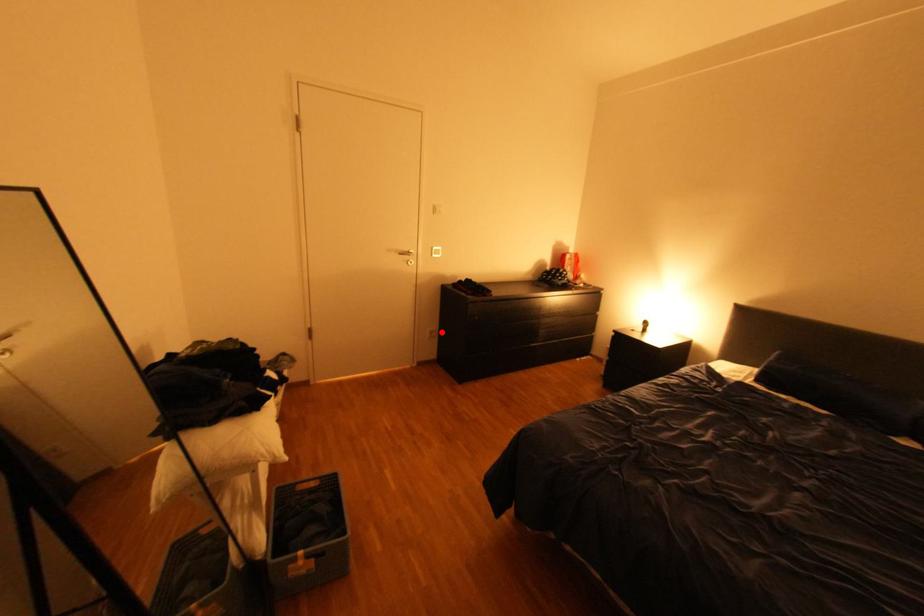
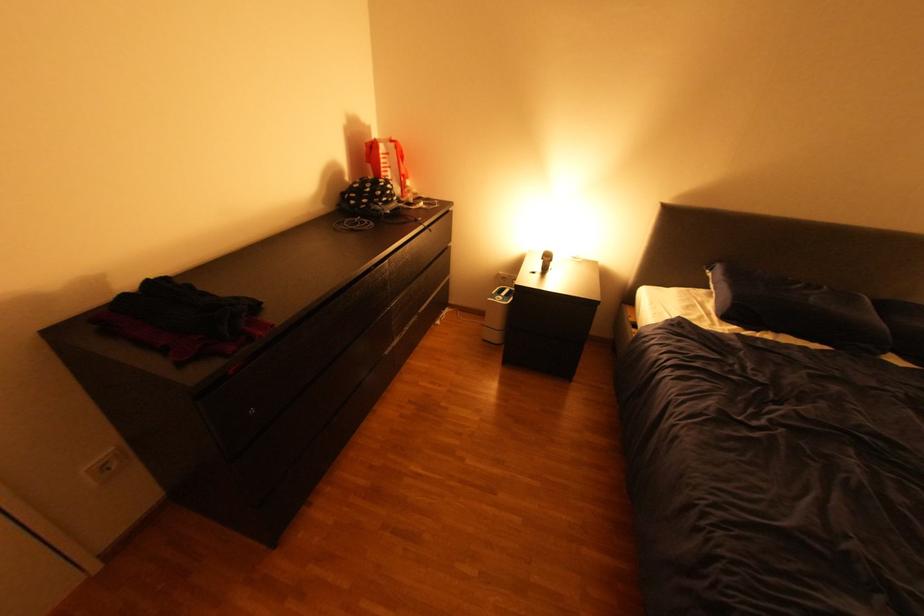
The point at the highlighted location is marked in the first image. Where is the corresponding point in the second image?

(114, 467)